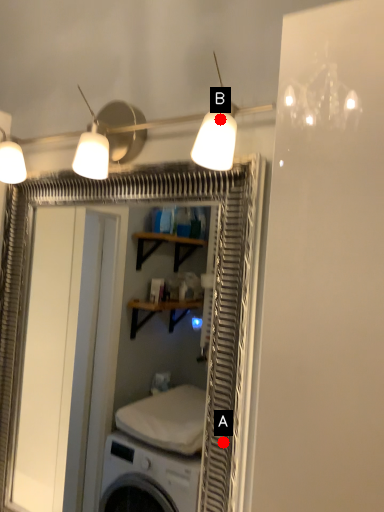
Question: Two points are circled on the image, labeled by A and B beside each circle. Which point is further to the camera?

Choices:
 (A) A is further
 (B) B is further

Answer: (A)